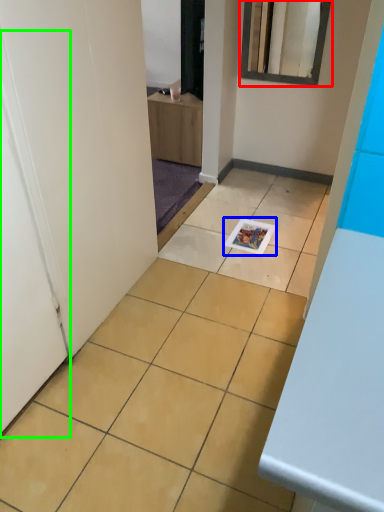
Question: Considering the real-world distances, which object is closest to mirror (highlighted by a red box)? magazine (highlighted by a blue box) or door (highlighted by a green box).

Choices:
 (A) magazine
 (B) door

Answer: (A)